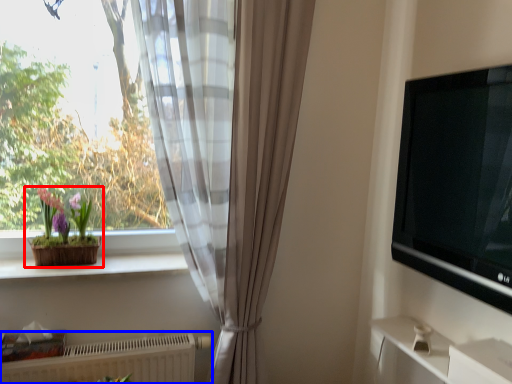
Question: Which object is further to the camera taking this photo, houseplant (highlighted by a red box) or radiator (highlighted by a blue box)?

Choices:
 (A) houseplant
 (B) radiator

Answer: (A)